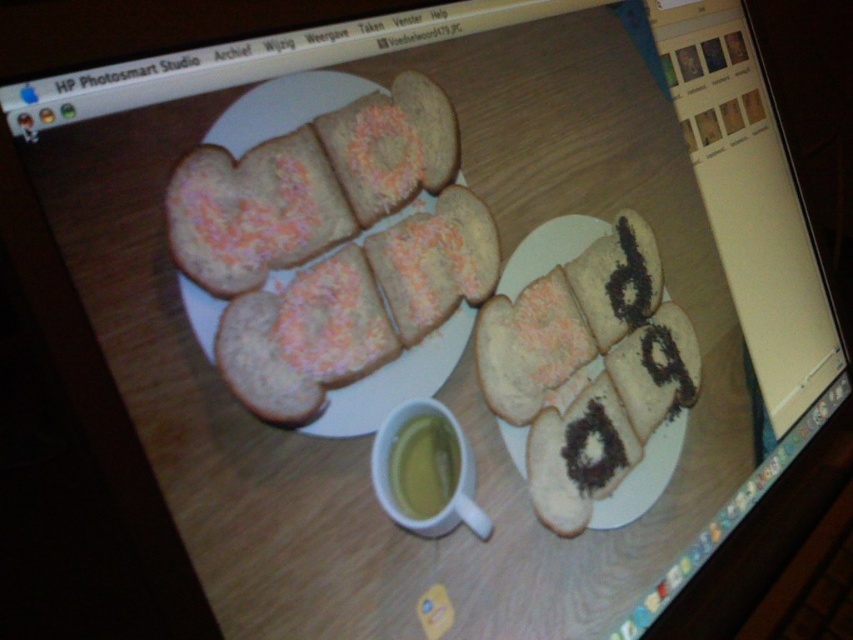
Question: Based on their relative distances, which object is farther from the chocolate frosted cookies at center?

Choices:
 (A) yellow translucent cup at center
 (B) white frosted cookies at center

Answer: (A)

Question: Does white frosted cookies at center appear on the left side of chocolate frosted cookies at center?

Choices:
 (A) no
 (B) yes

Answer: (B)

Question: Is white frosted cookies at center positioned behind yellow translucent cup at center?

Choices:
 (A) yes
 (B) no

Answer: (B)

Question: Is white frosted cookies at center to the left of yellow translucent cup at center from the viewer's perspective?

Choices:
 (A) yes
 (B) no

Answer: (A)

Question: Based on their relative distances, which object is nearer to the yellow translucent cup at center?

Choices:
 (A) chocolate frosted cookies at center
 (B) white frosted cookies at center

Answer: (B)

Question: Which point is closer to the camera?

Choices:
 (A) chocolate frosted cookies at center
 (B) white frosted cookies at center
 (C) yellow translucent cup at center

Answer: (B)